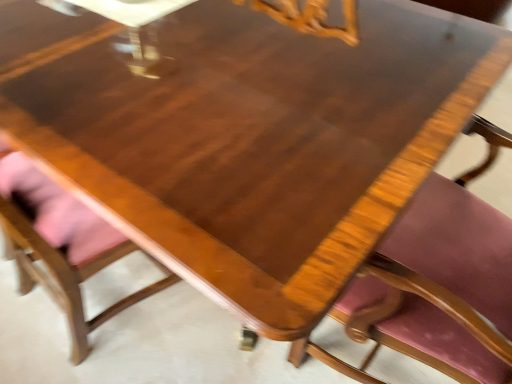
Question: Is the position of wooden chair with pink cushion at lower left, which ranks as the 1th chair in left-to-right order, more distant than that of wooden chair with pink cushion at center, which is the 1th chair from right to left?

Choices:
 (A) no
 (B) yes

Answer: (B)

Question: Does wooden chair with pink cushion at lower left, marked as the 2th chair in a right-to-left arrangement, have a smaller size compared to wooden chair with pink cushion at center, which is the 1th chair from right to left?

Choices:
 (A) yes
 (B) no

Answer: (A)

Question: Considering the relative positions of wooden chair with pink cushion at lower left, which ranks as the 1th chair in left-to-right order, and wooden chair with pink cushion at center, which ranks as the second chair in left-to-right order, in the image provided, is wooden chair with pink cushion at lower left, which ranks as the 1th chair in left-to-right order, in front of wooden chair with pink cushion at center, which ranks as the second chair in left-to-right order,?

Choices:
 (A) no
 (B) yes

Answer: (A)

Question: Considering the relative sizes of wooden chair with pink cushion at lower left, which ranks as the 1th chair in left-to-right order, and wooden chair with pink cushion at center, which is the 1th chair from right to left, in the image provided, is wooden chair with pink cushion at lower left, which ranks as the 1th chair in left-to-right order, wider than wooden chair with pink cushion at center, which is the 1th chair from right to left,?

Choices:
 (A) yes
 (B) no

Answer: (B)

Question: From a real-world perspective, is wooden chair with pink cushion at lower left, marked as the 2th chair in a right-to-left arrangement, positioned under wooden chair with pink cushion at center, which ranks as the second chair in left-to-right order, based on gravity?

Choices:
 (A) yes
 (B) no

Answer: (A)

Question: Is wooden chair with pink cushion at center, which ranks as the second chair in left-to-right order, surrounded by wooden chair with pink cushion at lower left, which ranks as the 1th chair in left-to-right order?

Choices:
 (A) no
 (B) yes

Answer: (A)

Question: Is wooden chair with pink cushion at center, which is the 1th chair from right to left, in contact with wooden chair with pink cushion at lower left, marked as the 2th chair in a right-to-left arrangement?

Choices:
 (A) no
 (B) yes

Answer: (A)

Question: Is wooden chair with pink cushion at center, which is the 1th chair from right to left, further to camera compared to wooden chair with pink cushion at lower left, marked as the 2th chair in a right-to-left arrangement?

Choices:
 (A) no
 (B) yes

Answer: (A)

Question: Is wooden chair with pink cushion at center, which ranks as the second chair in left-to-right order, at the right side of wooden chair with pink cushion at lower left, marked as the 2th chair in a right-to-left arrangement?

Choices:
 (A) yes
 (B) no

Answer: (A)

Question: Is wooden chair with pink cushion at center, which is the 1th chair from right to left, at the left side of wooden chair with pink cushion at lower left, marked as the 2th chair in a right-to-left arrangement?

Choices:
 (A) no
 (B) yes

Answer: (A)

Question: Is wooden chair with pink cushion at center, which is the 1th chair from right to left, oriented towards wooden chair with pink cushion at lower left, marked as the 2th chair in a right-to-left arrangement?

Choices:
 (A) no
 (B) yes

Answer: (A)

Question: Considering the relative sizes of wooden chair with pink cushion at center, which is the 1th chair from right to left, and wooden chair with pink cushion at lower left, which ranks as the 1th chair in left-to-right order, in the image provided, is wooden chair with pink cushion at center, which is the 1th chair from right to left, wider than wooden chair with pink cushion at lower left, which ranks as the 1th chair in left-to-right order,?

Choices:
 (A) no
 (B) yes

Answer: (B)

Question: From the image's perspective, is wooden chair with pink cushion at lower left, marked as the 2th chair in a right-to-left arrangement, located above or below wooden chair with pink cushion at center, which is the 1th chair from right to left?

Choices:
 (A) below
 (B) above

Answer: (B)